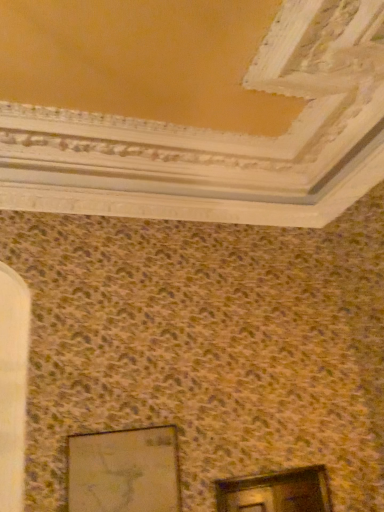
The width and height of the screenshot is (384, 512). Describe the element at coordinates (276, 492) in the screenshot. I see `matte glass window at lower center` at that location.

The width and height of the screenshot is (384, 512). What are the coordinates of `matte glass window at lower center` in the screenshot? It's located at (276, 492).

What do you see at coordinates (124, 471) in the screenshot?
I see `matte glass picture frame at lower left` at bounding box center [124, 471].

This screenshot has height=512, width=384. Find the location of `matte glass picture frame at lower left`. matte glass picture frame at lower left is located at coordinates (124, 471).

Locate an element on the screen. matte glass window at lower center is located at coordinates (276, 492).

Is matte glass picture frame at lower left to the right of matte glass window at lower center from the viewer's perspective?

No.

Consider the image. Is the depth of matte glass picture frame at lower left greater than that of matte glass window at lower center?

That is False.

Which is less distant, (163,430) or (315,485)?

The point (163,430) is closer to the camera.

From the image's perspective, is matte glass picture frame at lower left over matte glass window at lower center?

Correct, matte glass picture frame at lower left appears higher than matte glass window at lower center in the image.

From a real-world perspective, is matte glass picture frame at lower left located higher than matte glass window at lower center?

Yes, from a real-world perspective, matte glass picture frame at lower left is over matte glass window at lower center

Which of these two, matte glass picture frame at lower left or matte glass window at lower center, is thinner?

Thinner between the two is matte glass picture frame at lower left.

Does matte glass picture frame at lower left have a lesser height compared to matte glass window at lower center?

No.

Is matte glass picture frame at lower left smaller than matte glass window at lower center?

No.

Would you say matte glass picture frame at lower left is inside or outside matte glass window at lower center?

matte glass picture frame at lower left is located beyond the bounds of matte glass window at lower center.

Is matte glass picture frame at lower left in contact with matte glass window at lower center?

No, matte glass picture frame at lower left is not next to matte glass window at lower center.

Is matte glass picture frame at lower left facing away from matte glass window at lower center?

That's not correct — matte glass picture frame at lower left is not looking away from matte glass window at lower center.

How many degrees apart are the facing directions of matte glass picture frame at lower left and matte glass window at lower center?

0.322 degrees.

Find the location of `picture frame lying in front of the matte glass window at lower center`. picture frame lying in front of the matte glass window at lower center is located at coordinates (124, 471).

Visually, is matte glass window at lower center positioned to the left or to the right of matte glass picture frame at lower left?

matte glass window at lower center is to the right of matte glass picture frame at lower left.

Considering the relative positions of matte glass window at lower center and matte glass picture frame at lower left in the image provided, is matte glass window at lower center behind matte glass picture frame at lower left?

Yes, matte glass window at lower center is further from the camera.

Is point (234, 479) in front of point (156, 444)?

No, it is behind (156, 444).

From the image's perspective, which object appears higher, matte glass window at lower center or matte glass picture frame at lower left?

From the image's view, matte glass picture frame at lower left is above.

From a real-world perspective, is matte glass window at lower center located beneath matte glass picture frame at lower left?

Yes.

Between matte glass window at lower center and matte glass picture frame at lower left, which one has smaller width?

matte glass picture frame at lower left is thinner.

Is matte glass window at lower center shorter than matte glass picture frame at lower left?

Yes, matte glass window at lower center is shorter than matte glass picture frame at lower left.

Between matte glass window at lower center and matte glass picture frame at lower left, which one has larger size?

matte glass picture frame at lower left.

Is matte glass window at lower center not within matte glass picture frame at lower left?

That's correct, matte glass window at lower center is outside of matte glass picture frame at lower left.

Is matte glass window at lower center far from matte glass picture frame at lower left?

They are positioned close to each other.

Is matte glass picture frame at lower left at the back of matte glass window at lower center?

No, matte glass window at lower center is not facing away from matte glass picture frame at lower left.

How many degrees apart are the facing directions of matte glass window at lower center and matte glass picture frame at lower left?

The angular difference between matte glass window at lower center and matte glass picture frame at lower left is 0.322 degrees.

Locate an element on the screen. The width and height of the screenshot is (384, 512). window that is below the matte glass picture frame at lower left (from the image's perspective) is located at coordinates (276, 492).

The height and width of the screenshot is (512, 384). Find the location of `window behind the matte glass picture frame at lower left`. window behind the matte glass picture frame at lower left is located at coordinates (276, 492).

Find the location of a particular element. The image size is (384, 512). window on the right of matte glass picture frame at lower left is located at coordinates (276, 492).